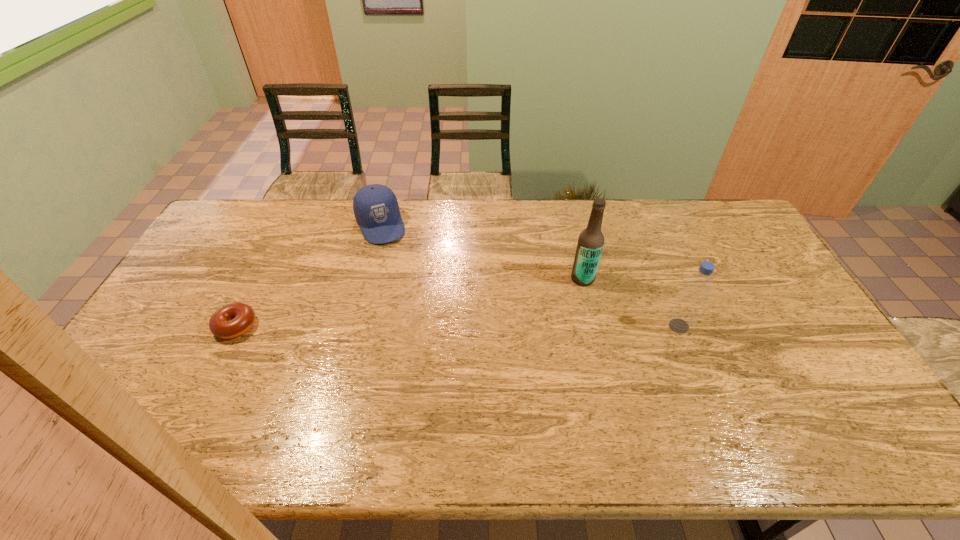
Find the location of a particular element. free point that satisfies the following two spatial constraints: 1. on the front side of the second tallest object; 2. on the right side of the shortest object is located at coordinates (236, 326).

You are a GUI agent. You are given a task and a screenshot of the screen. Output one action in this format:
    pyautogui.click(x=<x>, y=<y>)
    Task: Click on the free space that satisfies the following two spatial constraints: 1. on the back side of the doughnut; 2. on the right side of the second object from left to right
    The image size is (960, 540).
    Given the screenshot: What is the action you would take?
    tap(286, 225)